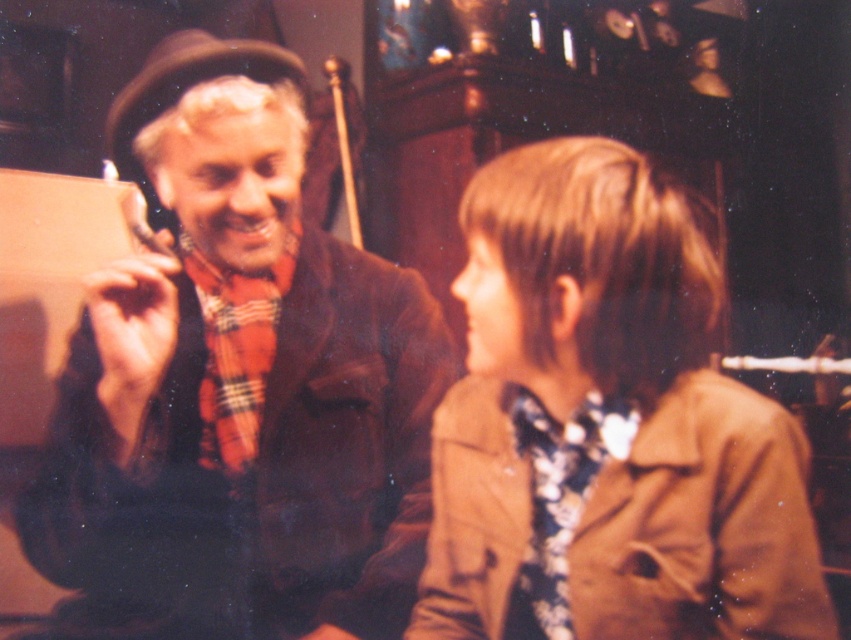
Question: Considering the relative positions of brown woolen sweater at left and floral fabric tie at lower right in the image provided, where is brown woolen sweater at left located with respect to floral fabric tie at lower right?

Choices:
 (A) above
 (B) below

Answer: (A)

Question: Does brown woolen sweater at left appear on the right side of brown leather trench coat at lower right?

Choices:
 (A) no
 (B) yes

Answer: (A)

Question: Estimate the real-world distances between objects in this image. Which object is closer to the floral fabric tie at lower right?

Choices:
 (A) brown leather trench coat at lower right
 (B) brown woolen sweater at left

Answer: (A)

Question: Which point appears closest to the camera in this image?

Choices:
 (A) (444, 483)
 (B) (208, 582)
 (C) (563, 488)

Answer: (C)

Question: Is brown leather trench coat at lower right smaller than floral fabric tie at lower right?

Choices:
 (A) no
 (B) yes

Answer: (A)

Question: Which point is farther to the camera?

Choices:
 (A) brown woolen sweater at left
 (B) floral fabric tie at lower right

Answer: (A)